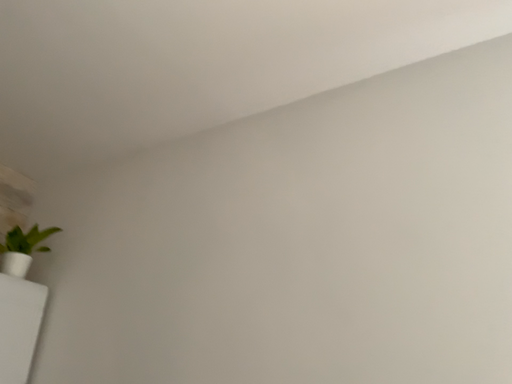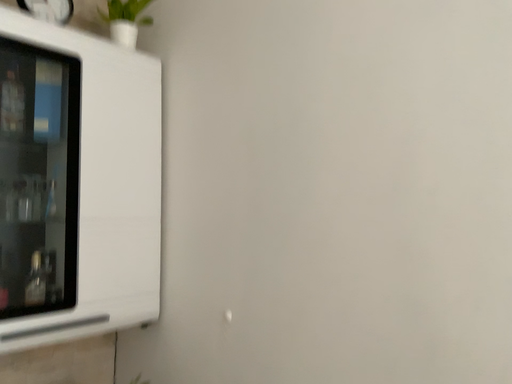
Question: Which way did the camera rotate in the video?

Choices:
 (A) rotated right
 (B) rotated left

Answer: (B)